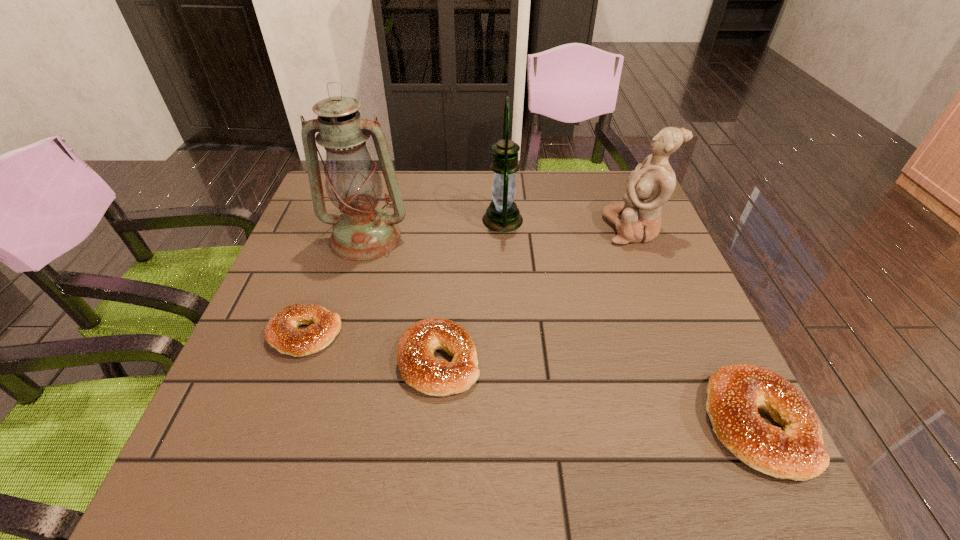
At what (x,y) coordinates should I click in order to perform the action: click on oil lamp at the far edge. Please return your answer as a coordinate pair (x, y). Image resolution: width=960 pixels, height=540 pixels. Looking at the image, I should click on (363, 231).

I want to click on figurine located in the far edge section of the desktop, so click(x=652, y=183).

Where is `bagel situated at the left edge`? The height and width of the screenshot is (540, 960). bagel situated at the left edge is located at coordinates (281, 332).

You are a GUI agent. You are given a task and a screenshot of the screen. Output one action in this format:
    pyautogui.click(x=<x>, y=<y>)
    Task: Click on the oil lamp located in the left edge section of the desktop
    The height and width of the screenshot is (540, 960).
    Given the screenshot: What is the action you would take?
    pyautogui.click(x=363, y=231)

This screenshot has height=540, width=960. What are the coordinates of `bagel that is at the right edge` in the screenshot? It's located at (735, 392).

Locate an element on the screen. This screenshot has width=960, height=540. figurine that is at the right edge is located at coordinates (652, 183).

This screenshot has height=540, width=960. Identify the location of object present at the far left corner. (363, 231).

Locate an element on the screen. The width and height of the screenshot is (960, 540). object located in the far right corner section of the desktop is located at coordinates (652, 183).

Locate an element on the screen. The image size is (960, 540). object that is at the near right corner is located at coordinates (735, 392).

I want to click on vacant region at the far edge, so click(468, 172).